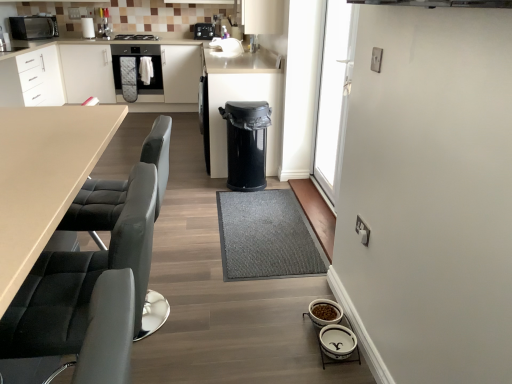
The height and width of the screenshot is (384, 512). What are the coordinates of `vacant area that is in front of black plastic trash can at center` in the screenshot? It's located at (248, 196).